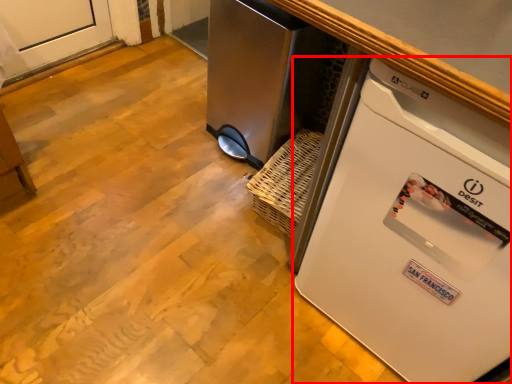
Question: From the image's perspective, what is the correct spatial relationship of home appliance (annotated by the red box) in relation to appliance?

Choices:
 (A) below
 (B) above

Answer: (A)